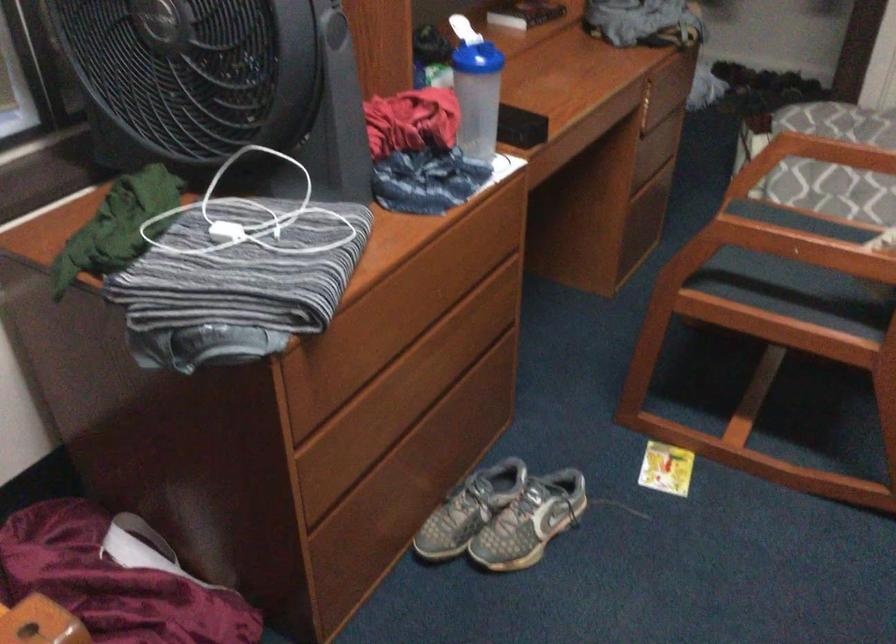
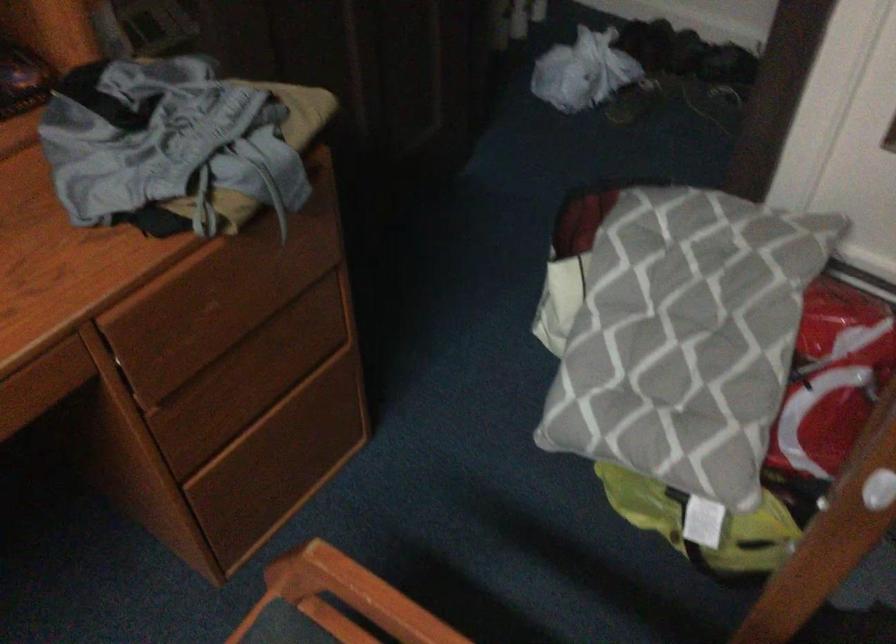
In the second image, find the point that corresponds to [652,144] in the first image.

(254, 377)